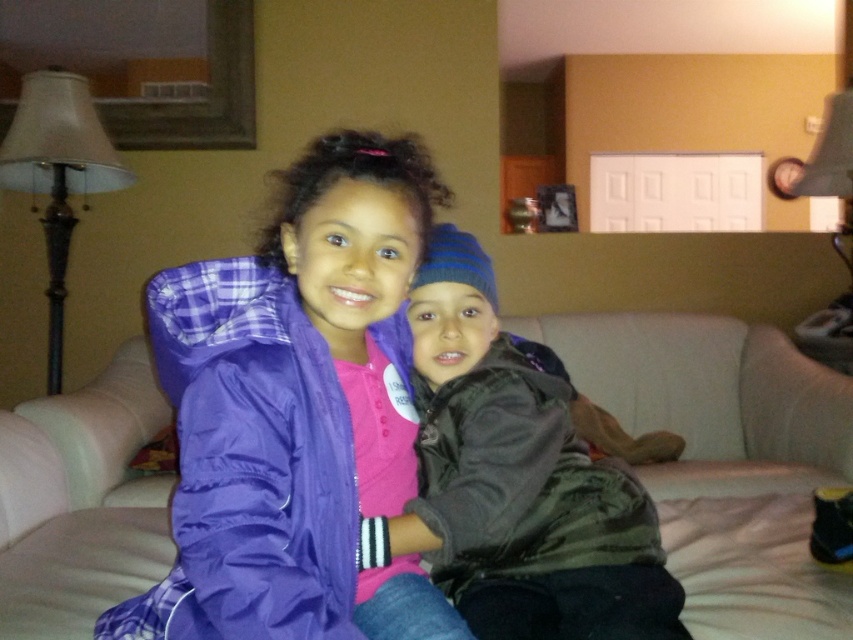
Who is positioned more to the right, beige fabric couch at center or dark gray fleece jacket at center?

beige fabric couch at center is more to the right.

Is beige fabric couch at center below dark gray fleece jacket at center?

Indeed, beige fabric couch at center is positioned under dark gray fleece jacket at center.

You are a GUI agent. You are given a task and a screenshot of the screen. Output one action in this format:
    pyautogui.click(x=<x>, y=<y>)
    Task: Click on the beige fabric couch at center
    The image size is (853, 640).
    Given the screenshot: What is the action you would take?
    pyautogui.click(x=724, y=458)

This screenshot has height=640, width=853. Find the location of `beige fabric couch at center`. beige fabric couch at center is located at coordinates (724, 458).

Does purple matte jacket at center have a greater height compared to black matte jacket at center?

Yes, purple matte jacket at center is taller than black matte jacket at center.

Who is positioned more to the right, purple matte jacket at center or black matte jacket at center?

Positioned to the right is black matte jacket at center.

Is point (245, 566) in front of point (450, 515)?

Yes, point (245, 566) is closer to viewer.

Locate an element on the screen. purple matte jacket at center is located at coordinates (292, 410).

Can you confirm if dark gray fleece jacket at center is wider than black matte jacket at center?

Yes, dark gray fleece jacket at center is wider than black matte jacket at center.

Can you confirm if dark gray fleece jacket at center is taller than black matte jacket at center?

Yes, dark gray fleece jacket at center is taller than black matte jacket at center.

Is point (459, 340) closer to camera compared to point (514, 436)?

No, it is not.

The height and width of the screenshot is (640, 853). Find the location of `dark gray fleece jacket at center`. dark gray fleece jacket at center is located at coordinates (519, 481).